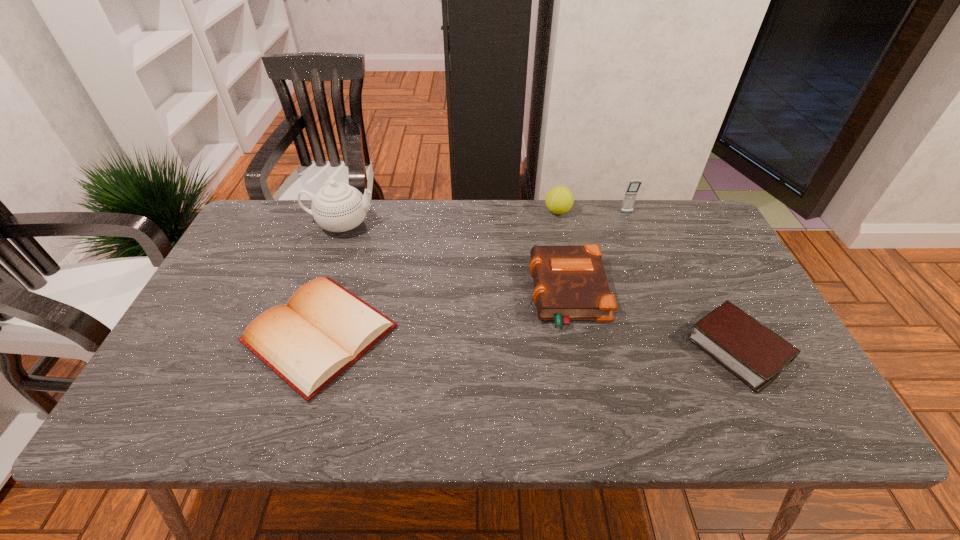
You are a GUI agent. You are given a task and a screenshot of the screen. Output one action in this format:
    pyautogui.click(x=<x>, y=<y>)
    Task: Click on the vacant area between the tennis ball and the shortest Bible
    
    Given the screenshot: What is the action you would take?
    pyautogui.click(x=439, y=273)

Find the location of a particular element. The height and width of the screenshot is (540, 960). free space that is in between the chinaware and the third tallest object is located at coordinates (450, 218).

Where is `free space between the second tallest Bible and the shortest object`? The width and height of the screenshot is (960, 540). free space between the second tallest Bible and the shortest object is located at coordinates (529, 342).

Find the location of a particular element. vacant space that is in between the rightmost object and the shortest Bible is located at coordinates (529, 342).

Where is `vacant space that's between the rightmost object and the leftmost Bible`? vacant space that's between the rightmost object and the leftmost Bible is located at coordinates (529, 342).

Identify the location of empty location between the second shortest Bible and the fourth tallest object. The height and width of the screenshot is (540, 960). (653, 322).

Locate an element on the screen. This screenshot has width=960, height=540. vacant point located between the fourth shortest object and the second object from right to left is located at coordinates (592, 212).

Where is `vacant area between the second Bible from left to right and the leftmost Bible`? vacant area between the second Bible from left to right and the leftmost Bible is located at coordinates (444, 314).

Where is `object that is the second closest to the second tallest object`? Image resolution: width=960 pixels, height=540 pixels. object that is the second closest to the second tallest object is located at coordinates 570,283.

This screenshot has height=540, width=960. What are the coordinates of `object that can be found as the closest to the chinaware` in the screenshot? It's located at pyautogui.click(x=324, y=328).